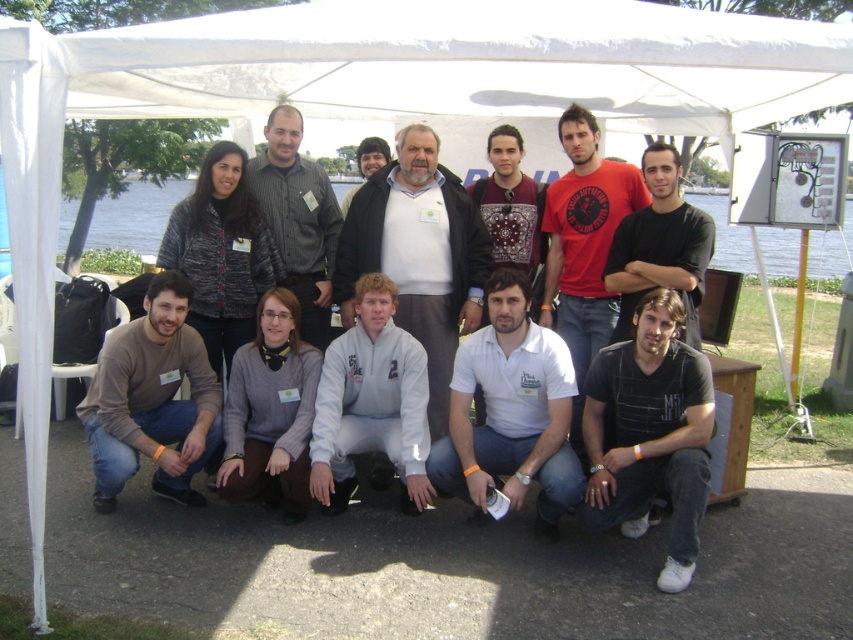
Is matte red t-shirt at center closer to camera compared to gray shirt at center?

Yes, matte red t-shirt at center is closer to the viewer.

Who is higher up, matte red t-shirt at center or gray shirt at center?

Positioned higher is gray shirt at center.

Find the location of `matte red t-shirt at center`. matte red t-shirt at center is located at coordinates (584, 244).

From the picture: Which of these two, brown textured sweater at lower left or gray fleece jacket at center, stands taller?

brown textured sweater at lower left is taller.

Identify the location of brown textured sweater at lower left. Image resolution: width=853 pixels, height=640 pixels. (152, 400).

At what (x,y) coordinates should I click in order to perform the action: click on brown textured sweater at lower left. Please return your answer as a coordinate pair (x, y). The width and height of the screenshot is (853, 640). Looking at the image, I should click on pos(152,400).

You are a GUI agent. You are given a task and a screenshot of the screen. Output one action in this format:
    pyautogui.click(x=<x>, y=<y>)
    Task: Click on the brown textured sweater at lower left
    This screenshot has height=640, width=853.
    Given the screenshot: What is the action you would take?
    pyautogui.click(x=152, y=400)

Between gray fleece jacket at center and black cotton t-shirt at center, which one has less height?

black cotton t-shirt at center

Between point (419, 396) and point (701, 211), which one is positioned behind?

The point (701, 211) is behind.

Describe the element at coordinates (370, 401) in the screenshot. Image resolution: width=853 pixels, height=640 pixels. I see `gray fleece jacket at center` at that location.

Locate an element on the screen. This screenshot has height=640, width=853. gray fleece jacket at center is located at coordinates (370, 401).